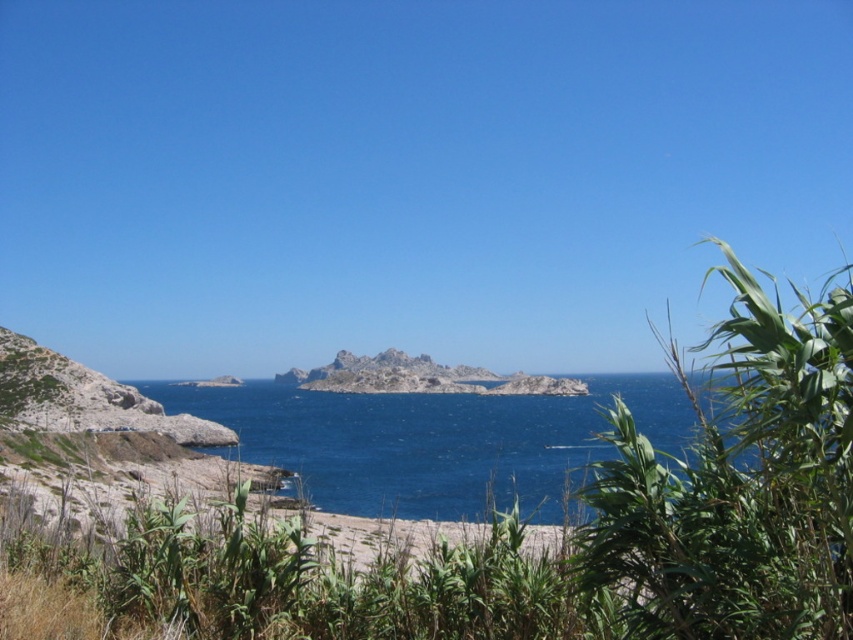
You are standing at the center of the image and want to take a photo of the green leafy plant at right. In which direction should you move to get a better view of it?

The green leafy plant at right is located at point (740,486), so you should move to the right to get a better view of it.

You are standing on the beach looking at the scene. Which object is nearer to you, the green leafy plant at right or the blue water at center?

The green leafy plant at right is closer to the viewer than the blue water at center.